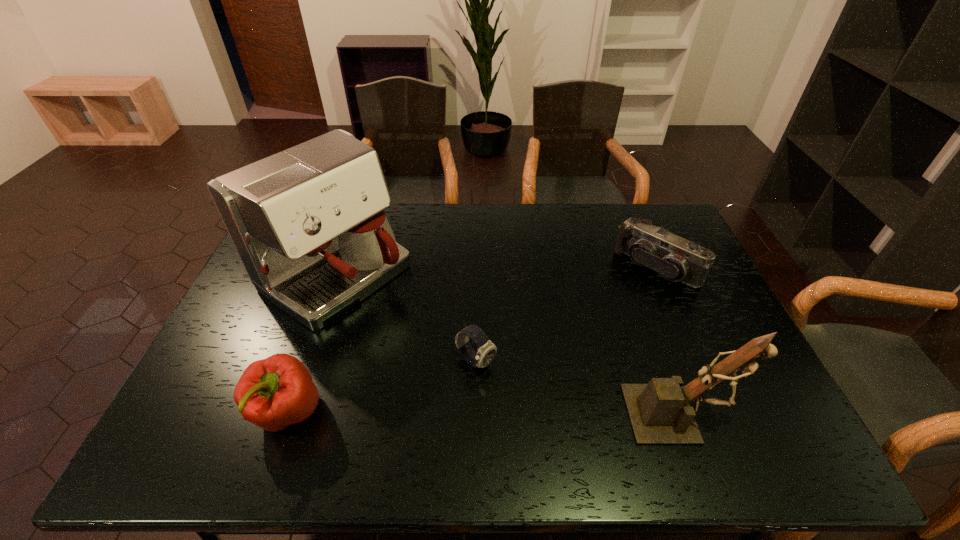
I want to click on vacant space located on the front-facing side of the camcorder, so click(x=628, y=293).

Find the location of a particular element. The image size is (960, 540). free space located on the front of the tallest object near the spout is located at coordinates (411, 328).

Where is `blank area located 0.300m on the front of the tallest object near the spout`? The height and width of the screenshot is (540, 960). blank area located 0.300m on the front of the tallest object near the spout is located at coordinates (461, 363).

Locate an element on the screen. vacant point located on the front of the tallest object near the spout is located at coordinates (406, 325).

Image resolution: width=960 pixels, height=540 pixels. What are the coordinates of `vacant space located on the face of the third farthest object` in the screenshot? It's located at 506,385.

The height and width of the screenshot is (540, 960). I want to click on blank space located on the face of the third farthest object, so coord(512,390).

Where is `vacant space located on the face of the third farthest object`? This screenshot has width=960, height=540. vacant space located on the face of the third farthest object is located at coordinates (534, 407).

Find the location of a particular element. This screenshot has height=540, width=960. object at the far edge is located at coordinates (308, 224).

In order to click on bell pepper positioned at the near edge in this screenshot , I will do `click(273, 393)`.

At what (x,y) coordinates should I click in order to perform the action: click on figurine at the near edge. Please return your answer as a coordinate pair (x, y). The image size is (960, 540). Looking at the image, I should click on (659, 412).